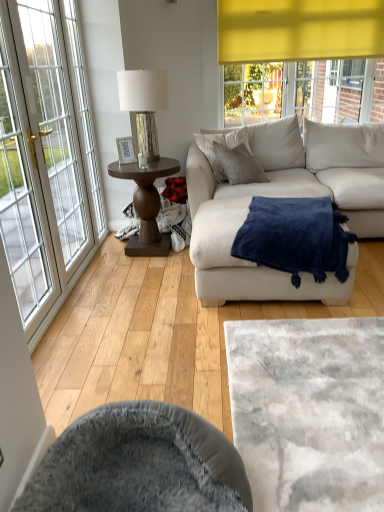
Question: Is velvet grey swivel chair at lower center not inside dark brown wood side table at center left?

Choices:
 (A) no
 (B) yes

Answer: (B)

Question: Does velvet grey swivel chair at lower center come in front of dark brown wood side table at center left?

Choices:
 (A) no
 (B) yes

Answer: (B)

Question: Does velvet grey swivel chair at lower center come behind dark brown wood side table at center left?

Choices:
 (A) yes
 (B) no

Answer: (B)

Question: Considering the relative sizes of velvet grey swivel chair at lower center and dark brown wood side table at center left in the image provided, is velvet grey swivel chair at lower center wider than dark brown wood side table at center left?

Choices:
 (A) no
 (B) yes

Answer: (B)

Question: From the image's perspective, is velvet grey swivel chair at lower center beneath dark brown wood side table at center left?

Choices:
 (A) yes
 (B) no

Answer: (A)

Question: From their relative heights in the image, would you say white glass window at left is taller or shorter than velvet grey swivel chair at lower center?

Choices:
 (A) tall
 (B) short

Answer: (A)

Question: Is white glass window at left wider or thinner than velvet grey swivel chair at lower center?

Choices:
 (A) thin
 (B) wide

Answer: (A)

Question: Is white glass window at left situated inside velvet grey swivel chair at lower center or outside?

Choices:
 (A) outside
 (B) inside

Answer: (A)

Question: From the image's perspective, is white glass window at left located above or below velvet grey swivel chair at lower center?

Choices:
 (A) above
 (B) below

Answer: (A)

Question: Is navy blue plush blanket at center to the left or to the right of textured gray pillow at center in the image?

Choices:
 (A) right
 (B) left

Answer: (A)

Question: Considering the positions of point (281, 263) and point (208, 156), is point (281, 263) closer or farther from the camera than point (208, 156)?

Choices:
 (A) farther
 (B) closer

Answer: (B)

Question: From the image's perspective, is navy blue plush blanket at center positioned above or below textured gray pillow at center?

Choices:
 (A) above
 (B) below

Answer: (B)

Question: Choose the correct answer: Is navy blue plush blanket at center inside textured gray pillow at center or outside it?

Choices:
 (A) inside
 (B) outside

Answer: (B)

Question: Is navy blue plush blanket at center bigger or smaller than velvet grey swivel chair at lower center?

Choices:
 (A) big
 (B) small

Answer: (A)

Question: In the image, is navy blue plush blanket at center on the left side or the right side of velvet grey swivel chair at lower center?

Choices:
 (A) right
 (B) left

Answer: (A)